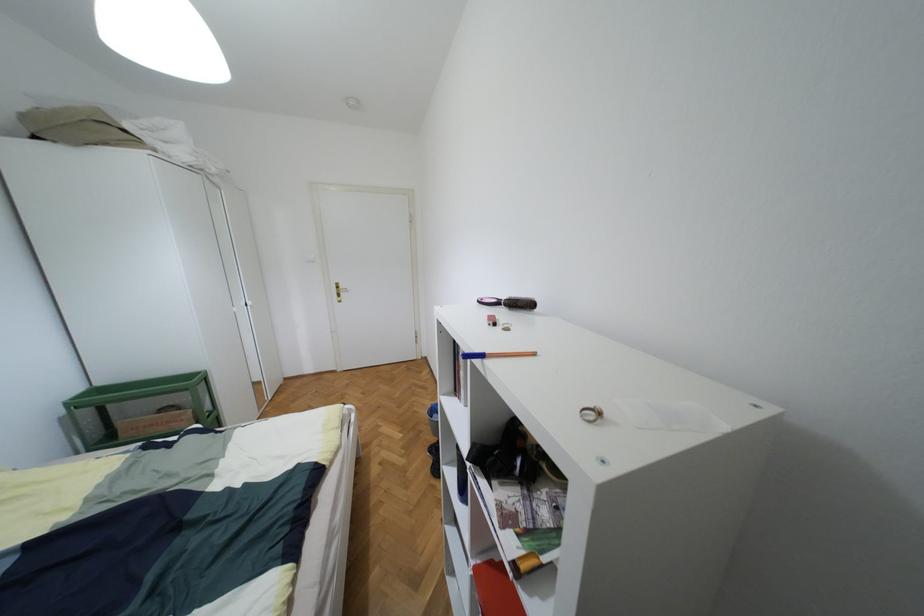
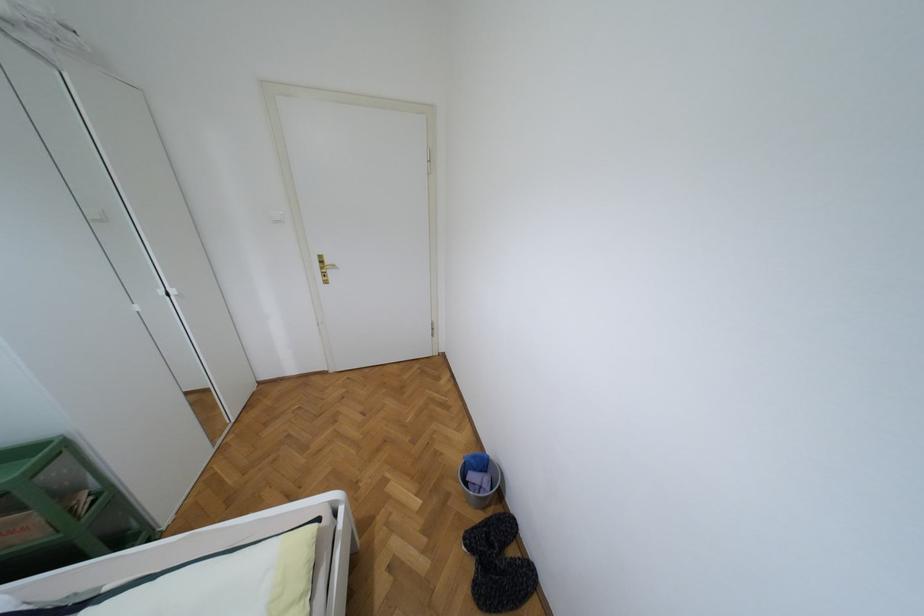
Question: Which direction would the cameraman need to move to produce the second image? Reply with the corresponding letter.

Choices:
 (A) Left
 (B) Right
 (C) Forward
 (D) Backward

Answer: (C)